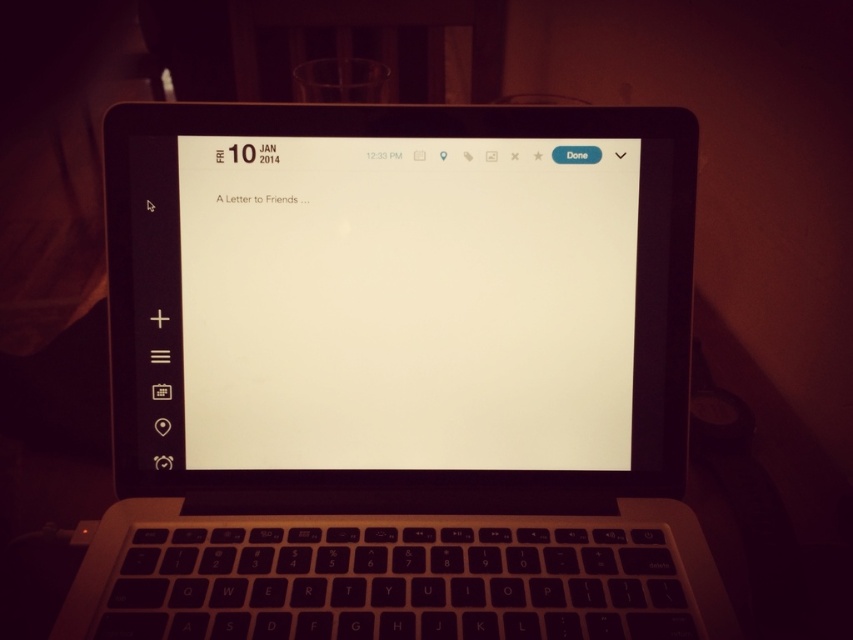
You are taking a photo of a laptop screen in low light. The laptop is positioned at point (398, 376). To ensure the screen is well lit, where should you place the light source relative to the camera?

The sleek black laptop at center is represented by point (398, 376). To ensure the screen is well lit, the light source should be positioned in front of the camera, facing the laptop screen to avoid shadows and reflections.

You are trying to click on the document title on the laptop screen. The screen has two points marked as point 1 at coordinates point (367, 292) and point 2 at coordinates point (589, 358). Which point is closer to you when you look at the screen?

A: Point (367, 292) is closer to the viewer than point (589, 358).

Consider the image. You are trying to locate the sleek black laptop at center in the image. What are the coordinates of its position?

The sleek black laptop at center is located at coordinates point (x=398, y=376).